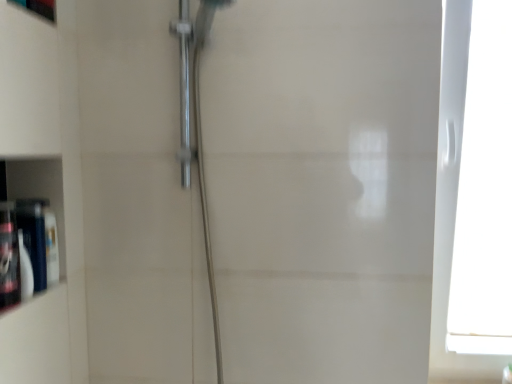
Question: Does matte white cabinet at left come in front of matte black bottle at left, the 1th toiletry when ordered from back to front?

Choices:
 (A) yes
 (B) no

Answer: (B)

Question: From the image's perspective, would you say matte white cabinet at left is shown under matte black bottle at left, the 1th toiletry when ordered from back to front?

Choices:
 (A) yes
 (B) no

Answer: (B)

Question: Can you confirm if matte white cabinet at left is bigger than matte black bottle at left, acting as the 2th toiletry starting from the front?

Choices:
 (A) yes
 (B) no

Answer: (B)

Question: Can you confirm if matte white cabinet at left is positioned to the right of matte black bottle at left, the 1th toiletry when ordered from back to front?

Choices:
 (A) yes
 (B) no

Answer: (B)

Question: Considering the relative sizes of matte white cabinet at left and matte black bottle at left, acting as the 2th toiletry starting from the front, in the image provided, is matte white cabinet at left taller than matte black bottle at left, acting as the 2th toiletry starting from the front,?

Choices:
 (A) yes
 (B) no

Answer: (A)

Question: From a real-world perspective, is matte white cabinet at left located higher than matte black bottle at left, the 1th toiletry when ordered from back to front?

Choices:
 (A) yes
 (B) no

Answer: (A)

Question: Does white plastic window at right have a smaller size compared to matte white cabinet at left?

Choices:
 (A) yes
 (B) no

Answer: (B)

Question: Are white plastic window at right and matte white cabinet at left located far from each other?

Choices:
 (A) no
 (B) yes

Answer: (B)

Question: Is white plastic window at right thinner than matte white cabinet at left?

Choices:
 (A) yes
 (B) no

Answer: (B)

Question: Is white plastic window at right looking in the opposite direction of matte white cabinet at left?

Choices:
 (A) no
 (B) yes

Answer: (A)

Question: Is white plastic window at right closer to camera compared to matte white cabinet at left?

Choices:
 (A) yes
 (B) no

Answer: (A)

Question: Would you say white plastic window at right is outside matte white cabinet at left?

Choices:
 (A) no
 (B) yes

Answer: (B)

Question: Does white plastic window at right lie behind matte black bottle at left, the 1th toiletry when ordered from back to front?

Choices:
 (A) no
 (B) yes

Answer: (B)